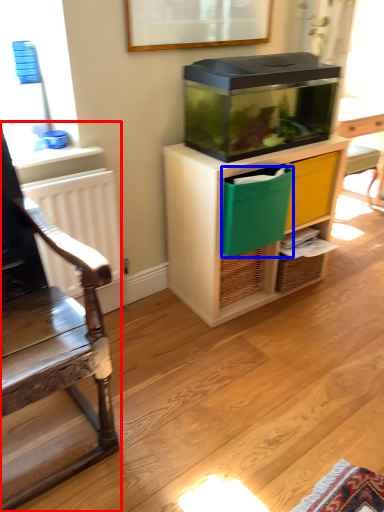
Question: Which point is closer to the camera, chair (highlighted by a red box) or crate (highlighted by a blue box)?

Choices:
 (A) chair
 (B) crate

Answer: (A)